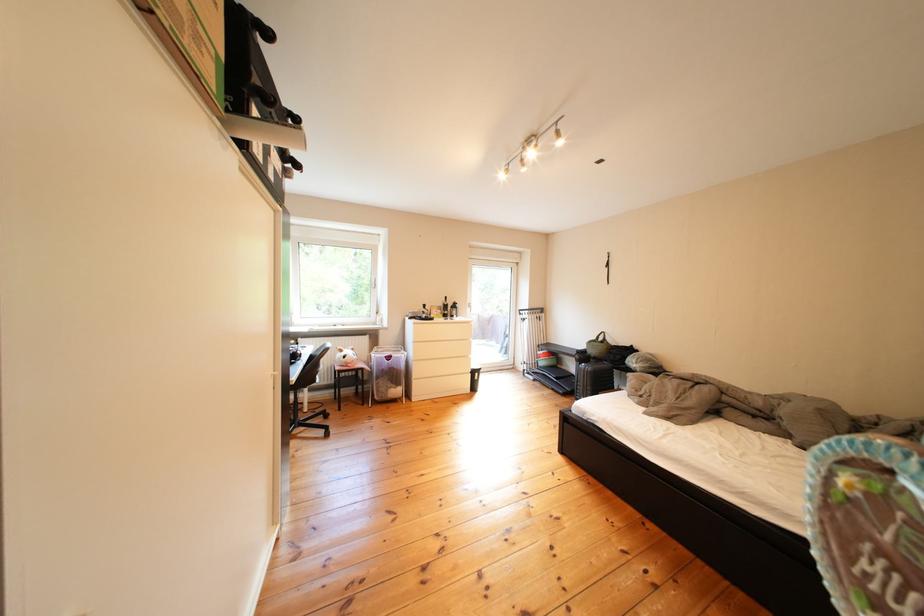
Where would you lift the green handbag? Please return your answer as a coordinate pair (x, y).

(868, 523)